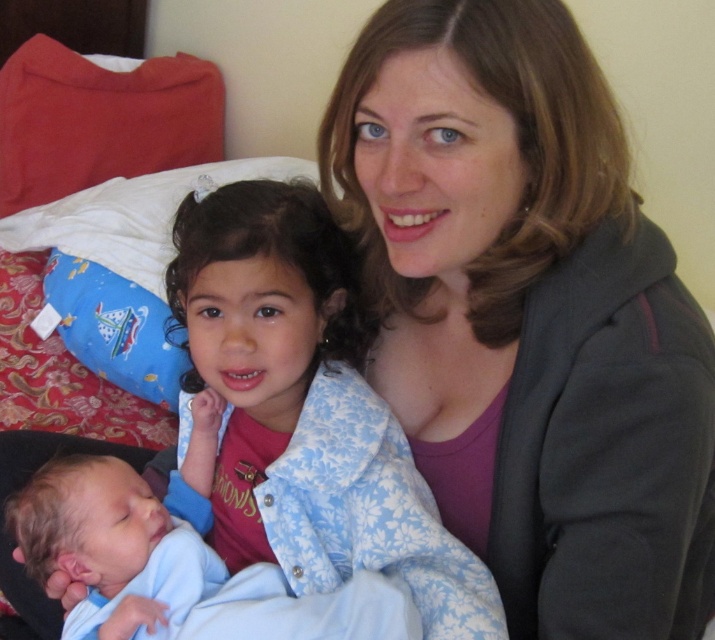
Question: Among these points, which one is farthest from the camera?

Choices:
 (A) (11, 205)
 (B) (92, 205)
 (C) (473, 630)

Answer: (A)

Question: Does matte gray hoodie at center have a lesser width compared to red soft pillow at upper left?

Choices:
 (A) no
 (B) yes

Answer: (B)

Question: Which of the following is the farthest from the observer?

Choices:
 (A) blue soft fabric newborn at lower left
 (B) matte gray hoodie at center
 (C) blue floral fabric at center

Answer: (C)

Question: Estimate the real-world distances between objects in this image. Which object is farther from the blue fabric pillow at upper left?

Choices:
 (A) matte gray hoodie at center
 (B) blue soft fabric newborn at lower left

Answer: (A)

Question: Is blue soft fabric newborn at lower left bigger than blue fabric pillow at upper left?

Choices:
 (A) no
 (B) yes

Answer: (A)

Question: Does blue fabric pillow at upper left have a lesser width compared to red soft pillow at upper left?

Choices:
 (A) no
 (B) yes

Answer: (A)